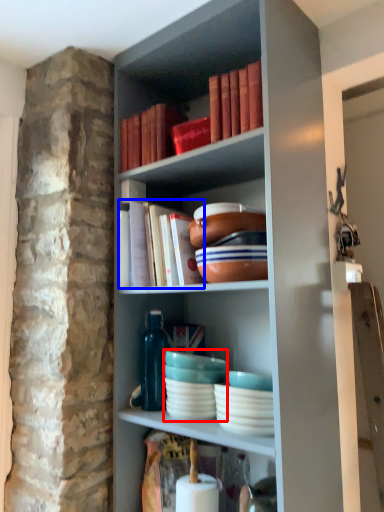
Question: Which point is further to the camera, tableware (highlighted by a red box) or book (highlighted by a blue box)?

Choices:
 (A) tableware
 (B) book

Answer: (A)